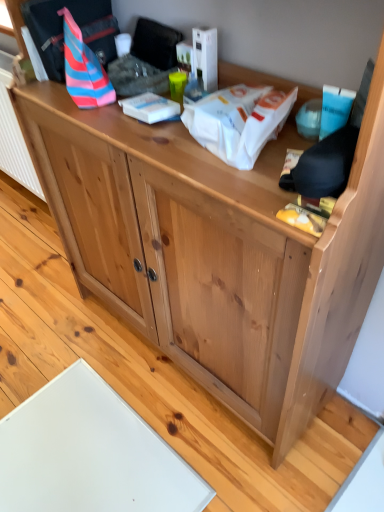
Question: Does point (89, 104) appear closer or farther from the camera than point (200, 117)?

Choices:
 (A) farther
 (B) closer

Answer: (A)

Question: In terms of width, does striped fabric bag at upper left, marked as the 1th kit in a left-to-right arrangement, look wider or thinner when compared to white paper at upper center, arranged as the first kit when viewed from the right?

Choices:
 (A) wide
 (B) thin

Answer: (B)

Question: Is striped fabric bag at upper left, the 2th kit viewed from the right, taller or shorter than white paper at upper center, arranged as the first kit when viewed from the right?

Choices:
 (A) tall
 (B) short

Answer: (A)

Question: Relative to striped fabric bag at upper left, marked as the 1th kit in a left-to-right arrangement, is white paper at upper center, the 2th kit from the left, in front or behind?

Choices:
 (A) behind
 (B) front

Answer: (B)

Question: In terms of size, does white paper at upper center, arranged as the first kit when viewed from the right, appear bigger or smaller than striped fabric bag at upper left, marked as the 1th kit in a left-to-right arrangement?

Choices:
 (A) big
 (B) small

Answer: (B)

Question: Does point (213, 126) appear closer or farther from the camera than point (74, 79)?

Choices:
 (A) closer
 (B) farther

Answer: (A)

Question: From the image's perspective, is white paper at upper center, arranged as the first kit when viewed from the right, located above or below striped fabric bag at upper left, marked as the 1th kit in a left-to-right arrangement?

Choices:
 (A) above
 (B) below

Answer: (B)